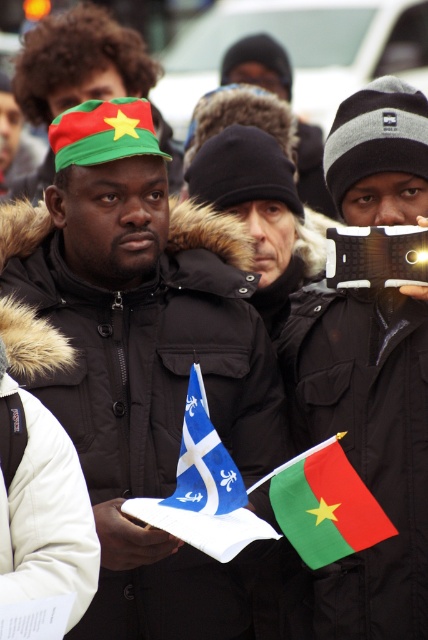
Question: Can you confirm if green fabric hat at upper left is positioned below black matte camera at center?

Choices:
 (A) no
 (B) yes

Answer: (A)

Question: Which point is closer to the camera taking this photo?

Choices:
 (A) 133,497
 (B) 234,67
 (C) 241,560

Answer: (A)

Question: Estimate the real-world distances between objects in this image. Which object is farther from the matte black jacket at center?

Choices:
 (A) white fabric flag at center
 (B) blue fabric flag at center
 (C) green fabric hat at upper left
 (D) black knit hat at center

Answer: (D)

Question: Does green fabric hat at upper left lie behind black knit hat at center?

Choices:
 (A) no
 (B) yes

Answer: (A)

Question: Which object is farther from the camera taking this photo?

Choices:
 (A) green matte flag at center
 (B) blue fabric flag at center

Answer: (B)

Question: Can you confirm if green matte flag at center is positioned to the right of blue fabric flag at center?

Choices:
 (A) yes
 (B) no

Answer: (A)